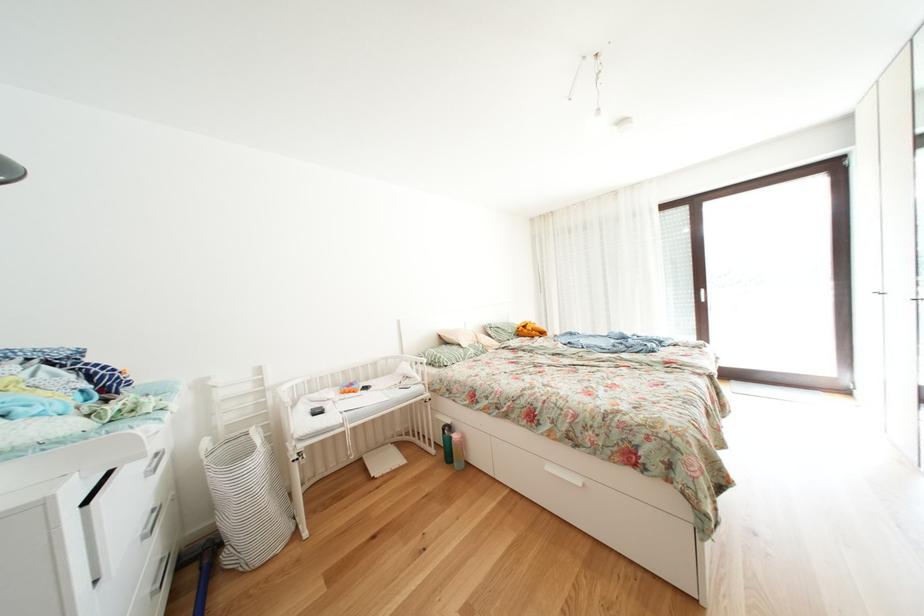
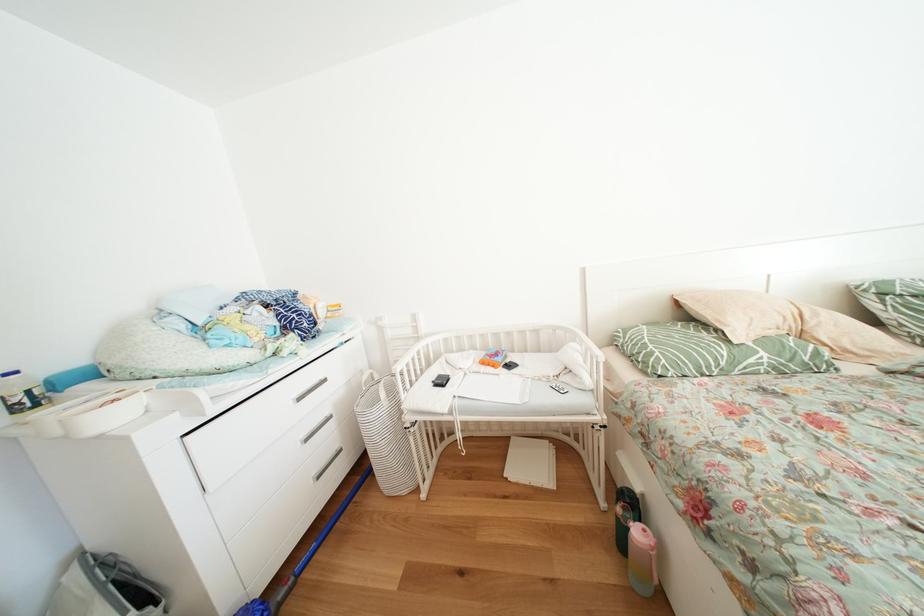
The first image is from the beginning of the video and the second image is from the end. How did the camera likely rotate when shooting the video?

The camera rotated toward left-down.